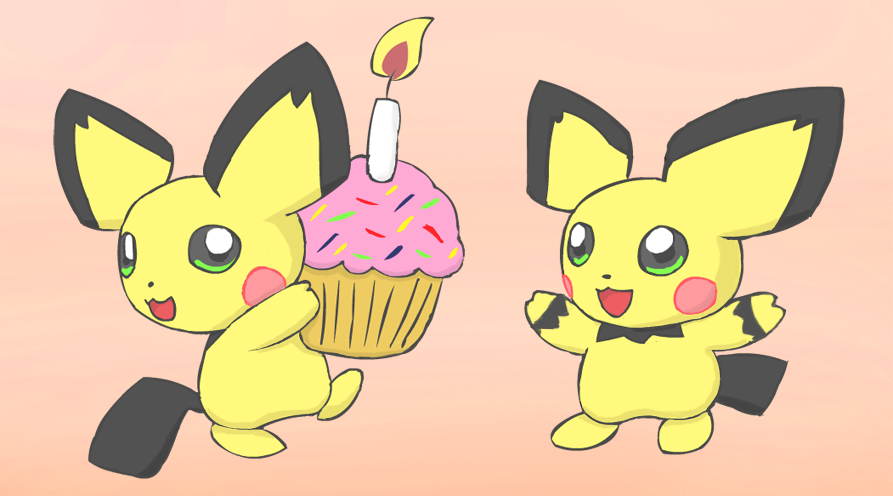
Find the location of `white candle`. white candle is located at coordinates (381, 145).